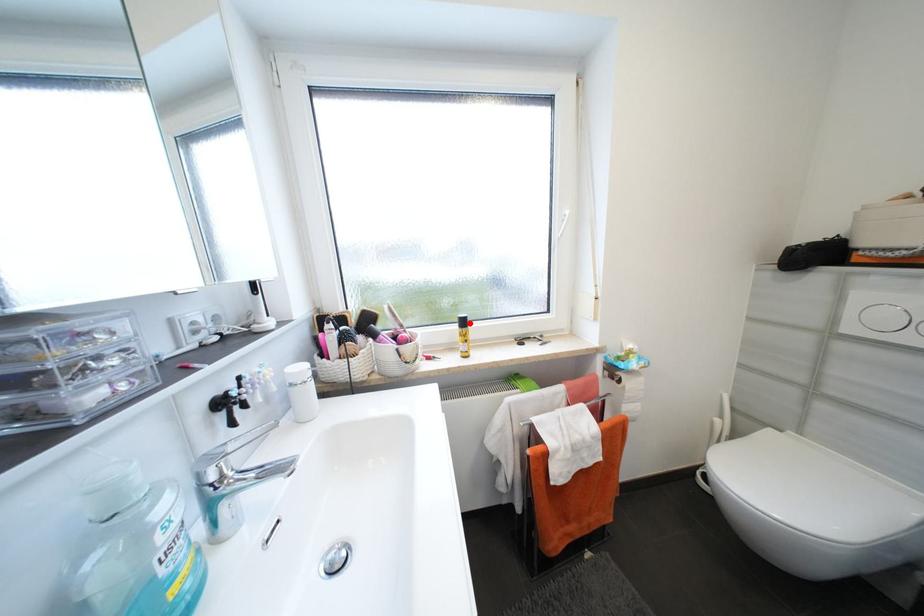
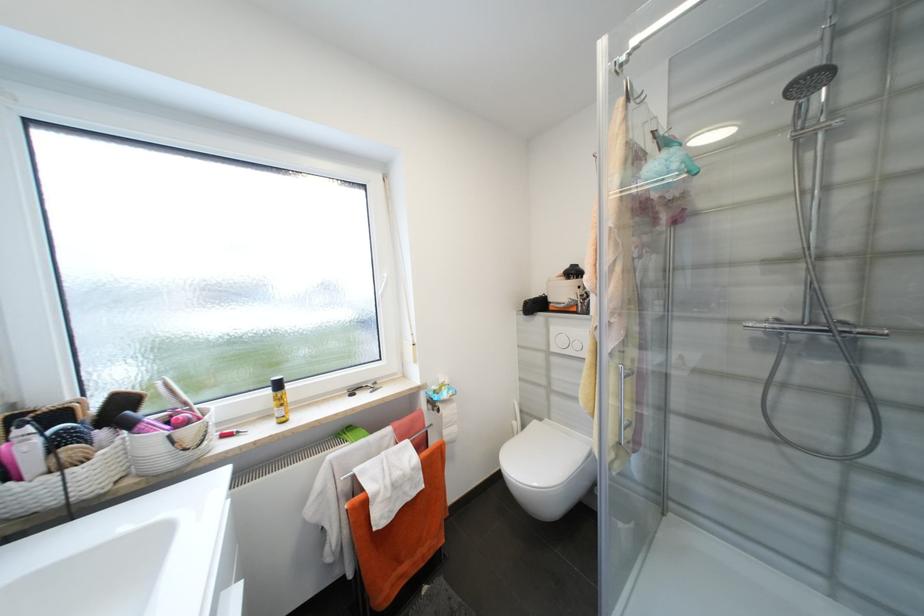
In the second image, find the point that corresponds to the highlighted location in the first image.

(284, 386)